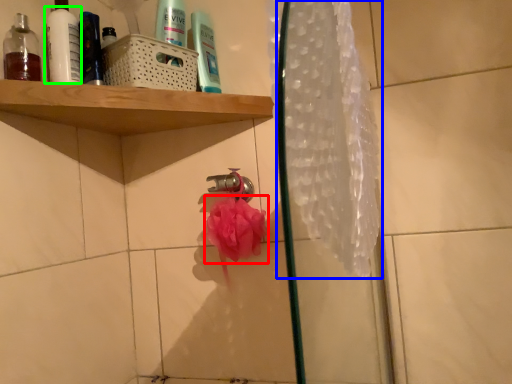
Question: Which is farther away from flower (highlighted by a red box)? shower curtain (highlighted by a blue box) or mouthwash (highlighted by a green box)?

Choices:
 (A) shower curtain
 (B) mouthwash

Answer: (B)